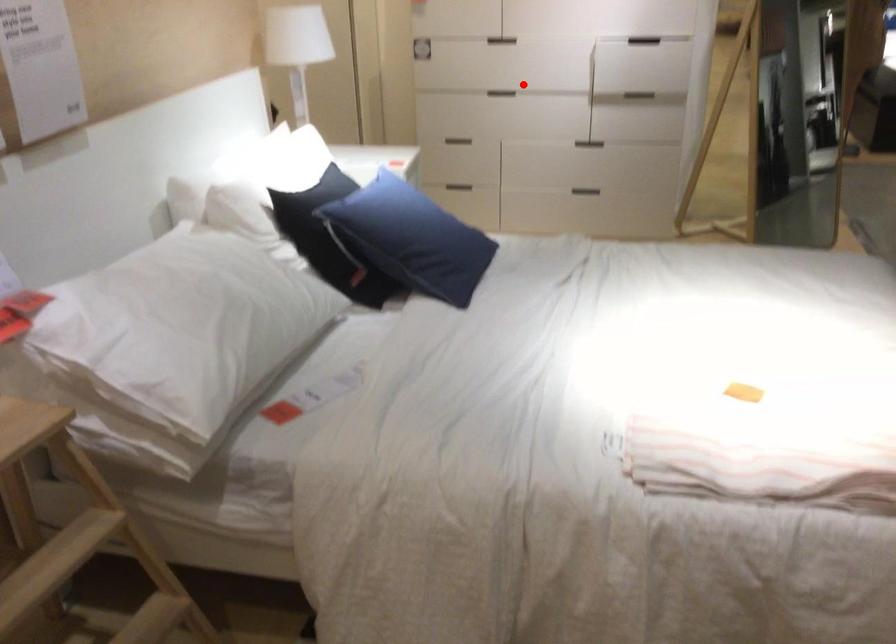
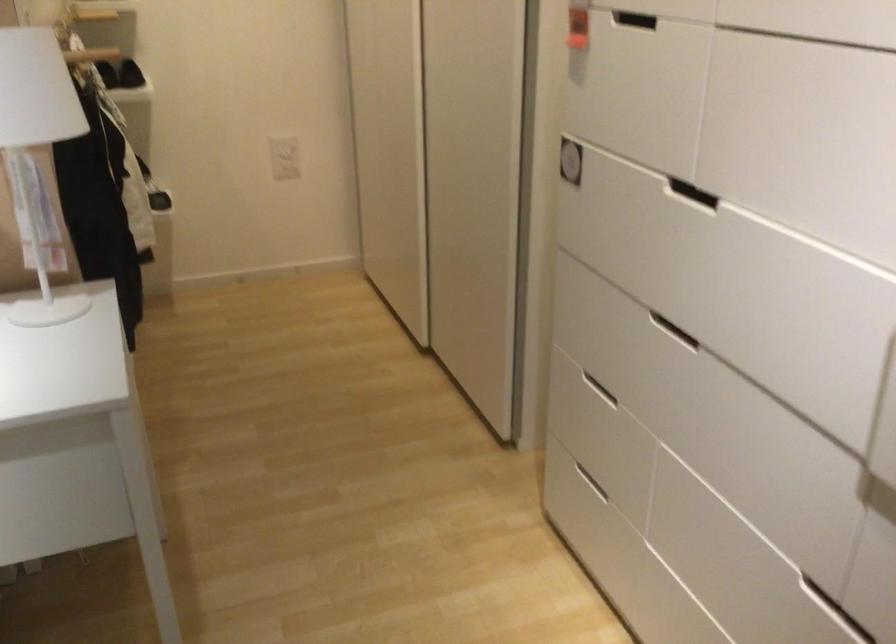
Find the pixel in the second image that matches the highlighted location in the first image.

(673, 330)